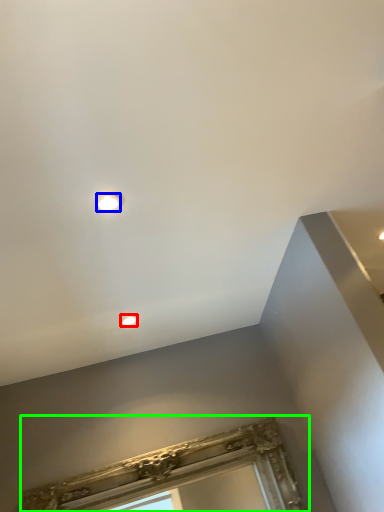
Question: Considering the real-world distances, which object is farthest from droplight (highlighted by a red box)? droplight (highlighted by a blue box) or window frame (highlighted by a green box)?

Choices:
 (A) droplight
 (B) window frame

Answer: (A)